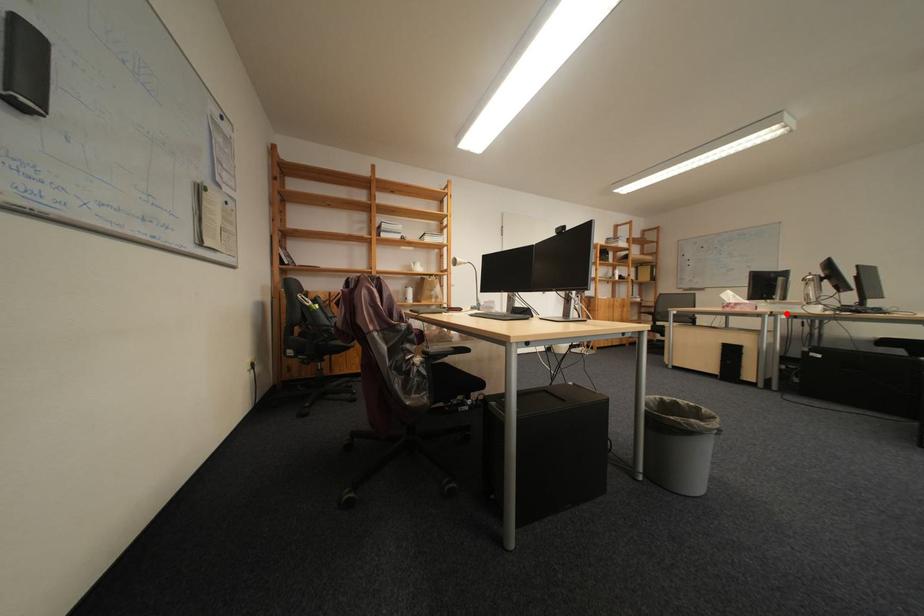
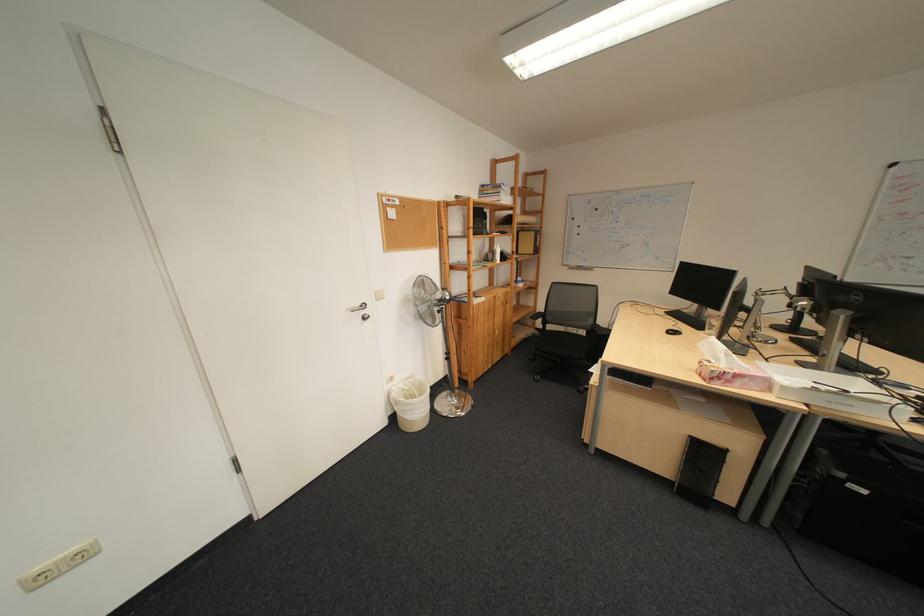
Find the pixel in the second image that matches the highlighted location in the first image.

(821, 407)